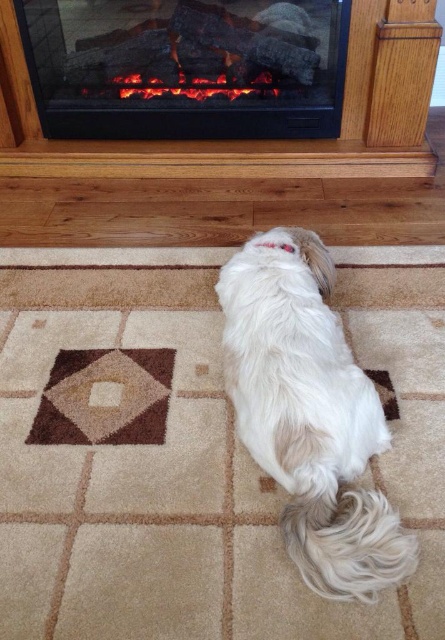
Question: Which of the following is the farthest from the observer?

Choices:
 (A) black electric fireplace at upper center
 (B) white fluffy dog at center

Answer: (A)

Question: Can you confirm if black electric fireplace at upper center is positioned to the left of white fluffy dog at center?

Choices:
 (A) yes
 (B) no

Answer: (A)

Question: Which point is farther to the camera?

Choices:
 (A) (319, 580)
 (B) (284, 17)

Answer: (B)

Question: Can you confirm if black electric fireplace at upper center is bigger than white fluffy dog at center?

Choices:
 (A) yes
 (B) no

Answer: (B)

Question: Which point is farther to the camera?

Choices:
 (A) black electric fireplace at upper center
 (B) white fluffy dog at center

Answer: (A)

Question: Where is black electric fireplace at upper center located in relation to white fluffy dog at center in the image?

Choices:
 (A) left
 (B) right

Answer: (A)